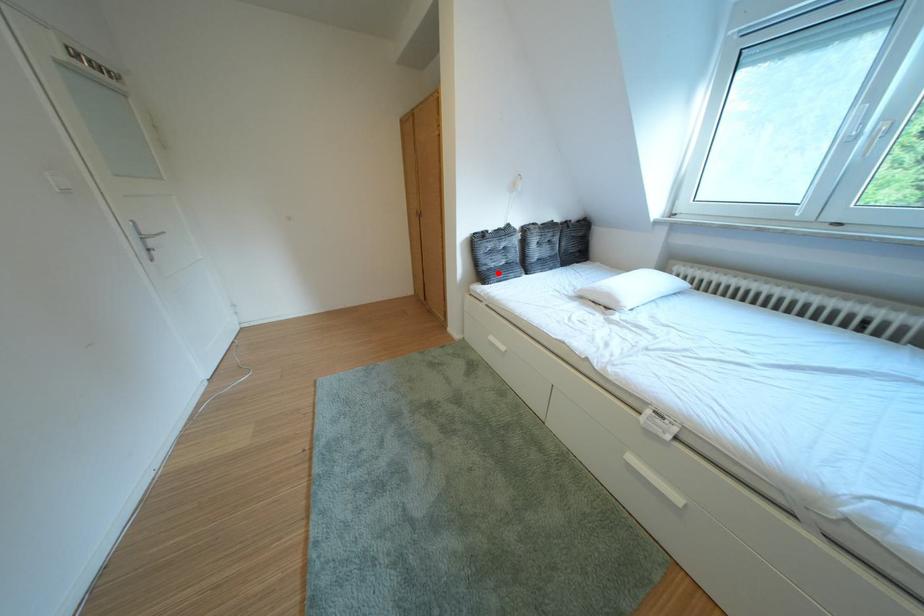
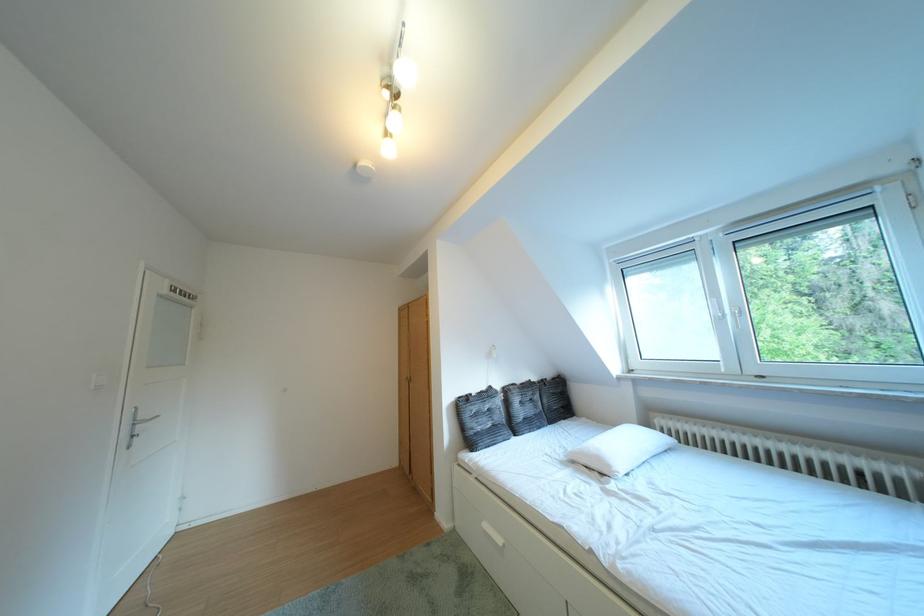
Where in the second image is the point corresponding to the highlighted location from the first image?

(484, 438)